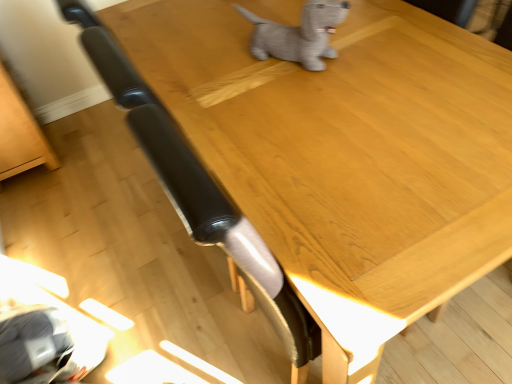
Locate an element on the screen. The height and width of the screenshot is (384, 512). vacant space in front of gray plush dog at upper center is located at coordinates (304, 104).